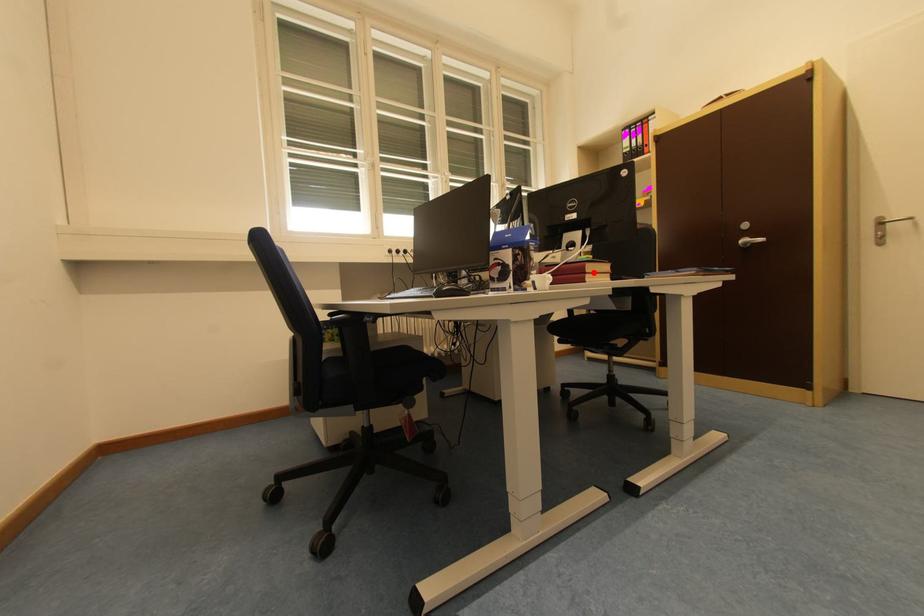
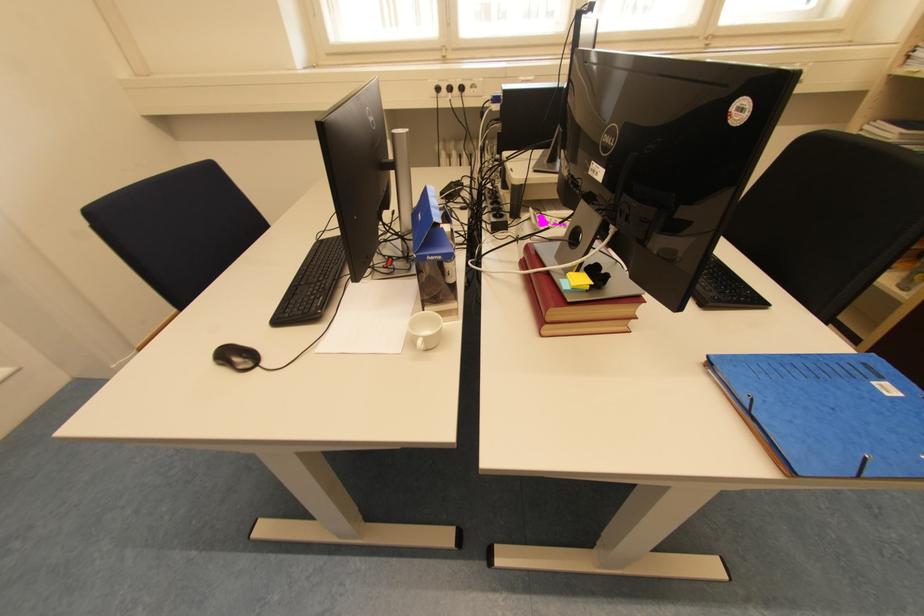
Find the pixel in the second image that matches the highlighted location in the first image.

(555, 321)